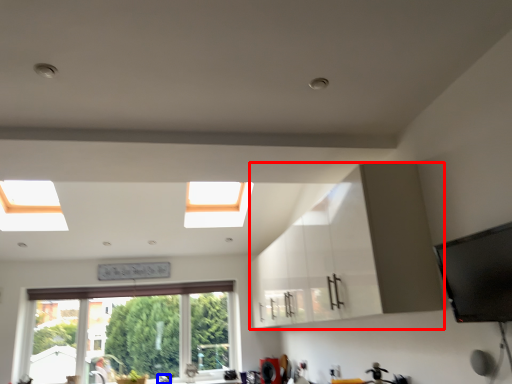
Question: Which point is closer to the camera, cabinetry (highlighted by a red box) or faucet (highlighted by a blue box)?

Choices:
 (A) cabinetry
 (B) faucet

Answer: (A)